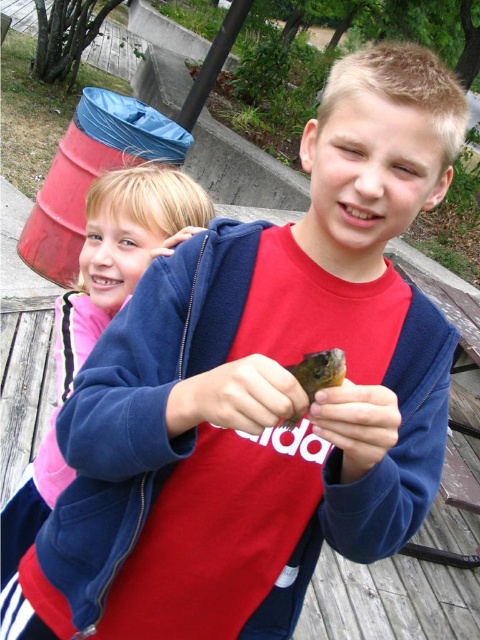
Question: Where is blue fleece jacket at upper left located in relation to smooth skin hand at center in the image?

Choices:
 (A) right
 (B) left

Answer: (B)

Question: Which point is closer to the camera?

Choices:
 (A) (169, 228)
 (B) (343, 387)
 (C) (197, 412)
 (D) (162, 243)

Answer: (B)

Question: Among these objects, which one is nearest to the camera?

Choices:
 (A) brown matte hand at center
 (B) matte blue sweatshirt at upper left
 (C) blue fleece jacket at upper left

Answer: (A)

Question: Does smooth skin hand at center appear under brown matte hand at center?

Choices:
 (A) yes
 (B) no

Answer: (B)

Question: Among these points, which one is farthest from the camera?

Choices:
 (A) (152, 250)
 (B) (47, 512)
 (C) (214, 419)
 (D) (333, 436)

Answer: (B)

Question: Is brown matte hand at center thinner than matte blue sweatshirt at upper left?

Choices:
 (A) no
 (B) yes

Answer: (B)